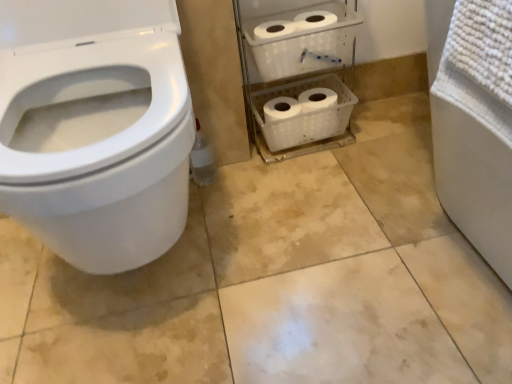
Find the location of a particular element. The height and width of the screenshot is (384, 512). vacant area that lies between white plastic shelf at center and white glossy toilet at left is located at coordinates (271, 216).